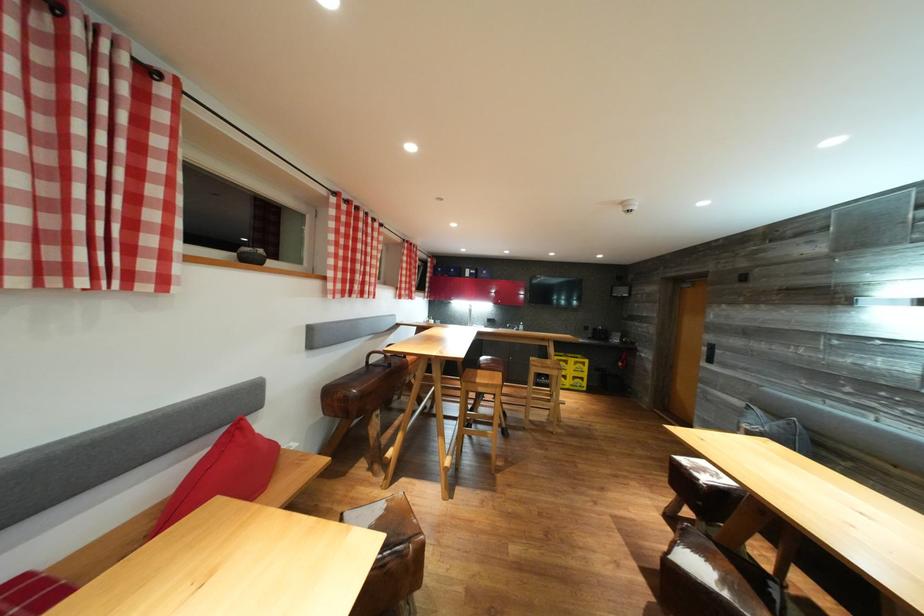
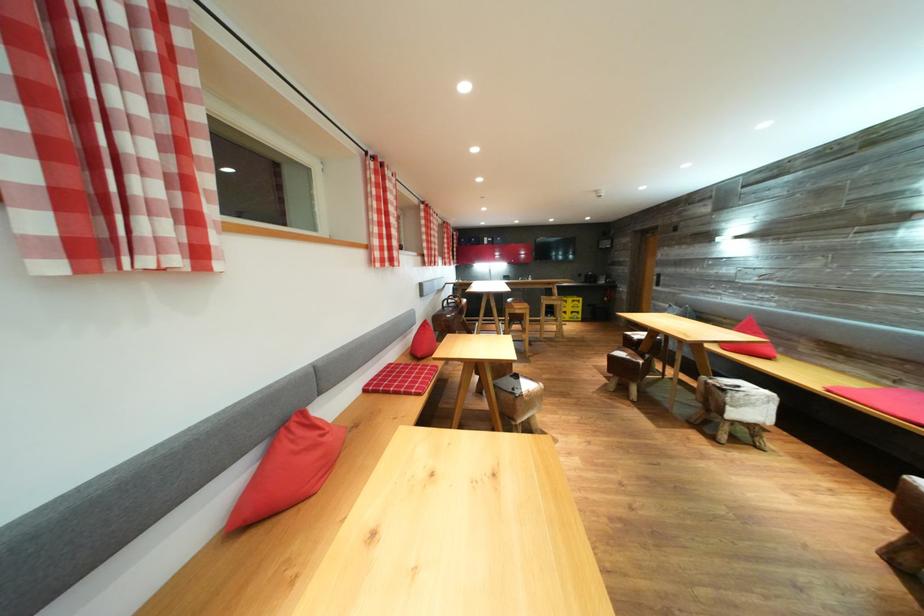
Which direction would the cameraman need to move to produce the second image?

The cameraman walked toward left, backward.